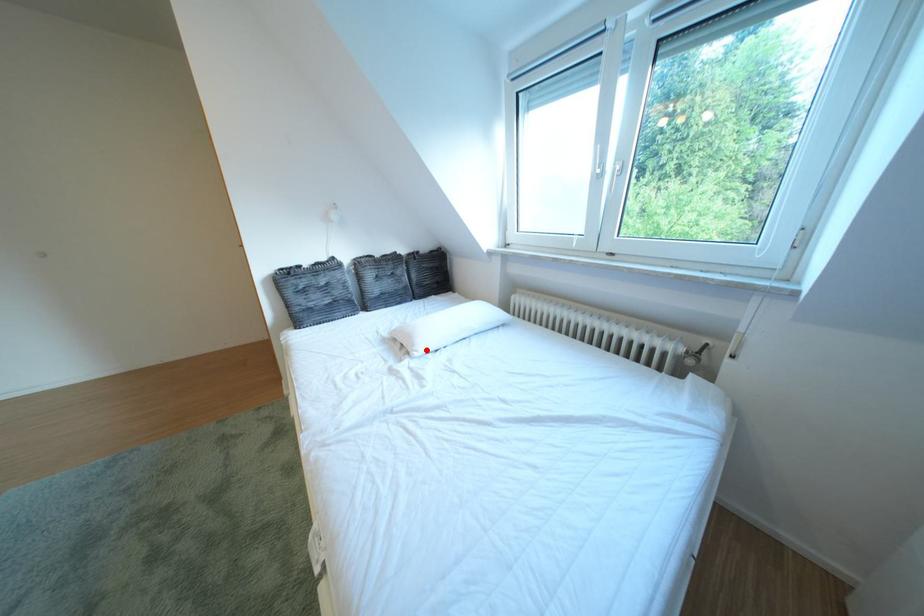
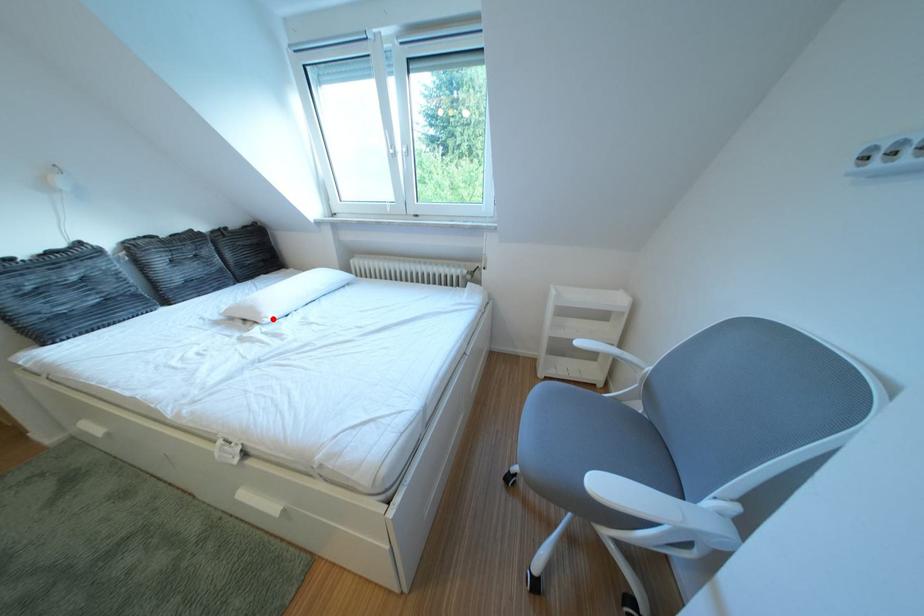
I am providing you with two images of the same scene from different viewpoints. A red point is marked on the first image and another point is marked on the second image. Does the point marked in image1 correspond to the same location as the one in image2?

Yes